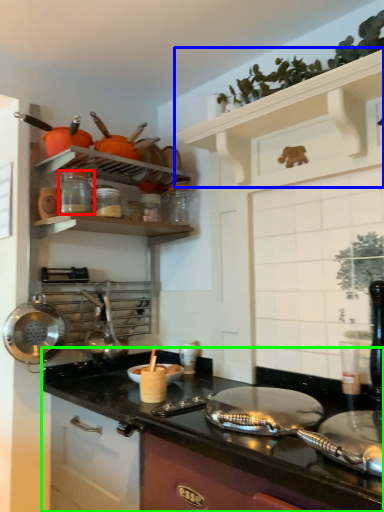
Question: Which object is the closest to the appliance (highlighted by a red box)? Choose among these: shelf (highlighted by a blue box) or countertop (highlighted by a green box).

Choices:
 (A) shelf
 (B) countertop

Answer: (A)